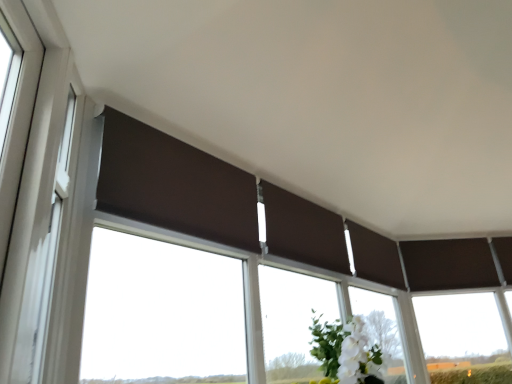
This screenshot has height=384, width=512. Describe the element at coordinates (463, 339) in the screenshot. I see `brown fabric window at center` at that location.

Where is `brown fabric window at center`? The height and width of the screenshot is (384, 512). brown fabric window at center is located at coordinates (463, 339).

This screenshot has width=512, height=384. What do you see at coordinates (32, 177) in the screenshot?
I see `white plastic window frame at left` at bounding box center [32, 177].

What are the coordinates of `white plastic window frame at left` in the screenshot? It's located at (32, 177).

Where is `brown fabric window at center`? The width and height of the screenshot is (512, 384). brown fabric window at center is located at coordinates (463, 339).

Looking at this image, which is more to the right, brown fabric window at center or white plastic window frame at left?

Positioned to the right is brown fabric window at center.

Between brown fabric window at center and white plastic window frame at left, which one is positioned behind?

Positioned behind is brown fabric window at center.

Does point (445, 328) appear closer or farther from the camera than point (9, 5)?

Point (445, 328).

From the image's perspective, is brown fabric window at center below white plastic window frame at left?

Yes, from the image's perspective, brown fabric window at center is beneath white plastic window frame at left.

From a real-world perspective, relative to white plastic window frame at left, is brown fabric window at center vertically above or below?

Clearly, from a real-world perspective, brown fabric window at center is below white plastic window frame at left.

Looking at their sizes, would you say brown fabric window at center is wider or thinner than white plastic window frame at left?

Clearly, brown fabric window at center has more width compared to white plastic window frame at left.

Can you confirm if brown fabric window at center is taller than white plastic window frame at left?

Yes.

Which of these two, brown fabric window at center or white plastic window frame at left, is smaller?

Smaller between the two is white plastic window frame at left.

Is brown fabric window at center inside or outside of white plastic window frame at left?

brown fabric window at center is outside white plastic window frame at left.

Based on the photo, would you consider brown fabric window at center to be distant from white plastic window frame at left?

brown fabric window at center is far away from white plastic window frame at left.

Is white plastic window frame at left at the back of brown fabric window at center?

No.

Can you tell me how much brown fabric window at center and white plastic window frame at left differ in facing direction?

91.7 degrees.

This screenshot has height=384, width=512. I want to click on window behind the white plastic window frame at left, so click(463, 339).

Between white plastic window frame at left and brown fabric window at center, which one appears on the left side from the viewer's perspective?

Positioned to the left is white plastic window frame at left.

Does white plastic window frame at left lie in front of brown fabric window at center?

Yes, it is in front of brown fabric window at center.

Considering the points (9, 193) and (453, 360), which point is behind, point (9, 193) or point (453, 360)?

The point (453, 360) is more distant.

From the image's perspective, relative to brown fabric window at center, is white plastic window frame at left above or below?

From the image's perspective, white plastic window frame at left appears above brown fabric window at center.

From a real-world perspective, which is physically below, white plastic window frame at left or brown fabric window at center?

In real-world perspective, brown fabric window at center is lower.

Considering the sizes of objects white plastic window frame at left and brown fabric window at center in the image provided, who is thinner, white plastic window frame at left or brown fabric window at center?

With smaller width is white plastic window frame at left.

Between white plastic window frame at left and brown fabric window at center, which one has less height?

white plastic window frame at left is shorter.

Who is bigger, white plastic window frame at left or brown fabric window at center?

brown fabric window at center.

Is white plastic window frame at left inside or outside of brown fabric window at center?

white plastic window frame at left is not inside brown fabric window at center, it's outside.

Is white plastic window frame at left touching brown fabric window at center?

There is a gap between white plastic window frame at left and brown fabric window at center.

Is white plastic window frame at left oriented towards brown fabric window at center?

No, white plastic window frame at left is not aimed at brown fabric window at center.

Identify the location of window located behind the white plastic window frame at left. The width and height of the screenshot is (512, 384). (463, 339).

You are a GUI agent. You are given a task and a screenshot of the screen. Output one action in this format:
    pyautogui.click(x=<x>, y=<y>)
    Task: Click on the window located underneath the white plastic window frame at left (from a real-world perspective)
    
    Given the screenshot: What is the action you would take?
    pyautogui.click(x=463, y=339)

Find the location of `window behind the white plastic window frame at left`. window behind the white plastic window frame at left is located at coordinates (463, 339).